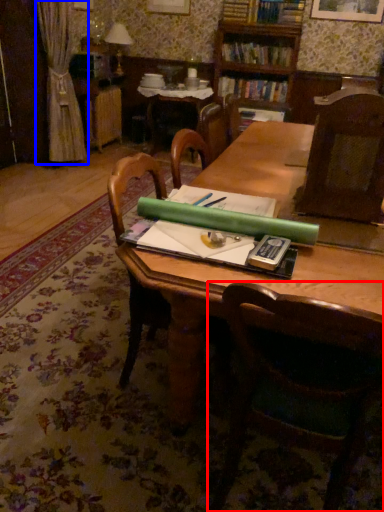
Question: Which point is closer to the camera, chair (highlighted by a red box) or curtain (highlighted by a blue box)?

Choices:
 (A) chair
 (B) curtain

Answer: (A)